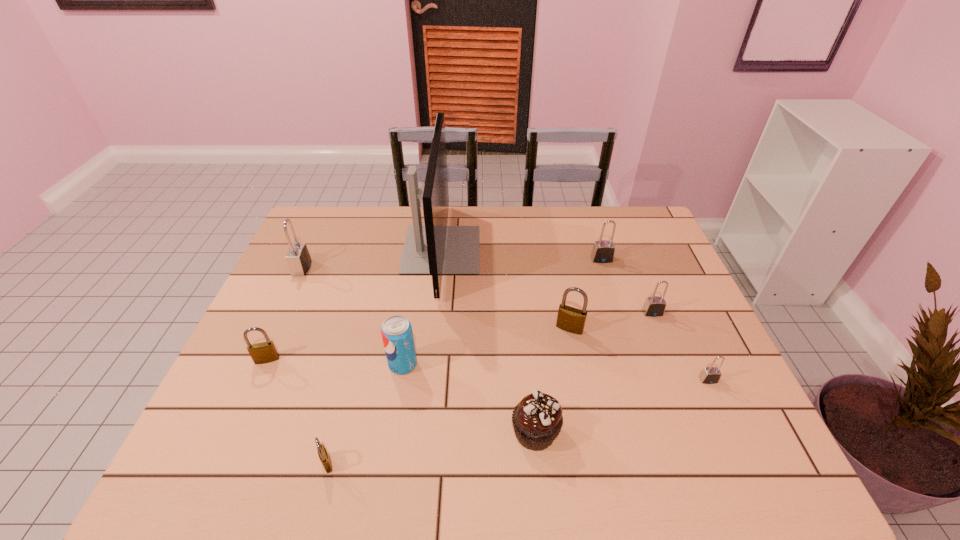
You are a GUI agent. You are given a task and a screenshot of the screen. Output one action in this format:
    pyautogui.click(x=<x>, y=<y>)
    Task: Click on the second smallest gray padlock
    The height and width of the screenshot is (540, 960).
    Given the screenshot: What is the action you would take?
    pyautogui.click(x=654, y=306)

The width and height of the screenshot is (960, 540). Find the location of `the seventh nearest object`. the seventh nearest object is located at coordinates (654, 306).

Locate an element on the screen. Image resolution: width=960 pixels, height=540 pixels. the fifth object from right to left is located at coordinates (537, 420).

Identify the location of cupcake. The width and height of the screenshot is (960, 540). (537, 420).

Where is `the smallest gray padlock`? The height and width of the screenshot is (540, 960). the smallest gray padlock is located at coordinates (710, 375).

At what (x,y) coordinates should I click in order to perform the action: click on the rightmost padlock. Please return your answer as a coordinate pair (x, y). This screenshot has height=540, width=960. Looking at the image, I should click on (710, 375).

This screenshot has width=960, height=540. In order to click on the nearest brass padlock in this screenshot , I will do pyautogui.click(x=322, y=453).

I want to click on the fifth padlock from right to left, so click(322, 453).

This screenshot has width=960, height=540. I want to click on blank area located on the screen of the tallest object, so pyautogui.click(x=538, y=249).

Identify the location of free space located 0.150m on the shackle of the ninth shortest object. (358, 268).